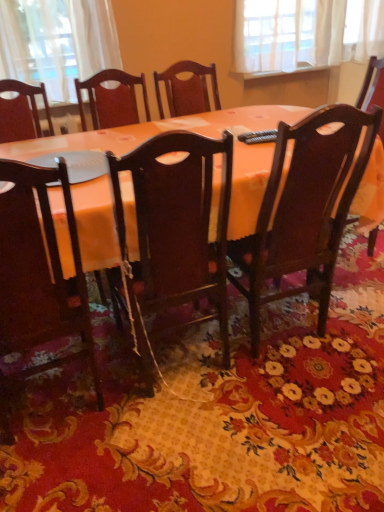
Where is `free space in front of matte dark wood chair at lower left, marked as the 1th chair in a left-to-right arrangement`? Image resolution: width=384 pixels, height=512 pixels. free space in front of matte dark wood chair at lower left, marked as the 1th chair in a left-to-right arrangement is located at coordinates (72, 482).